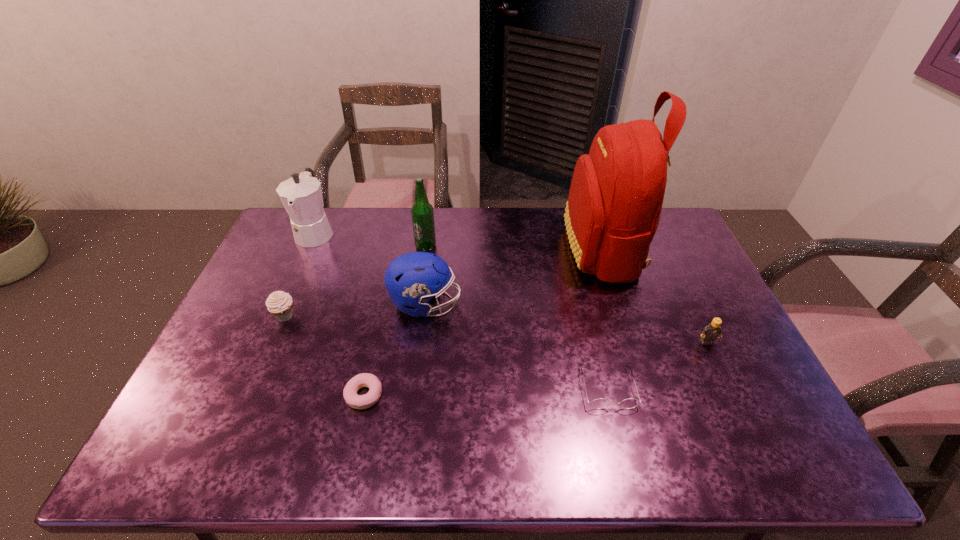
At what (x,y) coordinates should I click in order to perform the action: click on backpack. Please return your answer as a coordinate pair (x, y). The width and height of the screenshot is (960, 540). Looking at the image, I should click on (615, 200).

Where is `beer bottle`? beer bottle is located at coordinates (422, 213).

Locate an element on the screen. coffeepot is located at coordinates (301, 195).

This screenshot has width=960, height=540. I want to click on the fourth tallest object, so click(413, 279).

Where is `muffin`? This screenshot has width=960, height=540. muffin is located at coordinates (279, 303).

The height and width of the screenshot is (540, 960). In order to click on the sixth farthest object in this screenshot , I will do `click(712, 330)`.

This screenshot has height=540, width=960. Identify the location of Lego. (712, 330).

The width and height of the screenshot is (960, 540). Identify the location of spectacles. (601, 403).

Where is `the shortest object`? the shortest object is located at coordinates point(368,380).

Where is `vacant region located on the front-facing side of the tallest object`? This screenshot has height=540, width=960. vacant region located on the front-facing side of the tallest object is located at coordinates point(493,248).